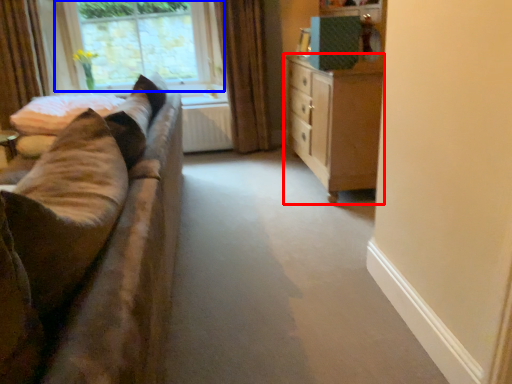
Question: Among these objects, which one is farthest to the camera, chest of drawers (highlighted by a red box) or window (highlighted by a blue box)?

Choices:
 (A) chest of drawers
 (B) window

Answer: (B)